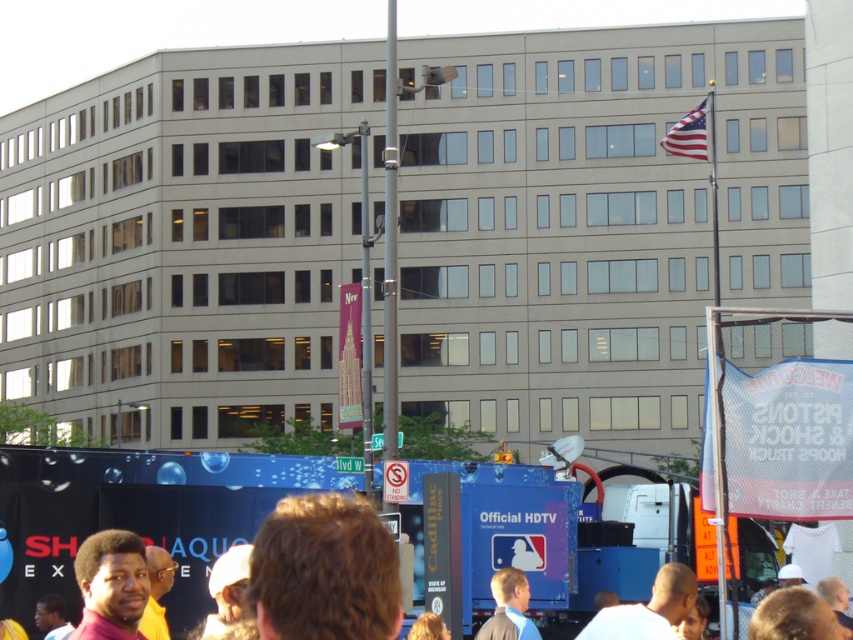
Question: Considering the real-world distances, which object is closest to the brown curly hair at lower center?

Choices:
 (A) white fabric turban at lower center
 (B) light brown hair at lower right
 (C) blonde hair at lower center

Answer: (A)

Question: Is light brown hair at lower right bigger than white fabric turban at lower center?

Choices:
 (A) no
 (B) yes

Answer: (B)

Question: Can you confirm if blonde hair at lower right is positioned below light brown suit at center?

Choices:
 (A) yes
 (B) no

Answer: (B)

Question: Does dark brown skin at lower left appear on the left side of blonde hair at lower center?

Choices:
 (A) yes
 (B) no

Answer: (A)

Question: Which point is farther to the camera?

Choices:
 (A) blonde hair at lower right
 (B) dark brown skin at lower left
 (C) white fabric turban at lower center

Answer: (A)

Question: Among these points, which one is nearest to the camera?

Choices:
 (A) (781, 593)
 (B) (434, 621)

Answer: (A)